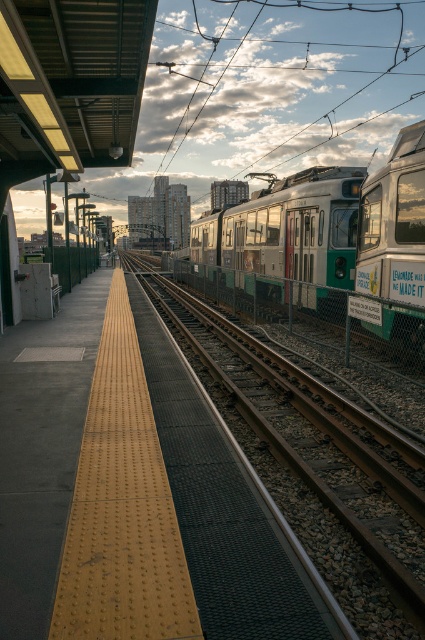
Can you confirm if green metallic train at center is positioned to the left of silver metallic train at center?

Incorrect, green metallic train at center is not on the left side of silver metallic train at center.

Who is higher up, green metallic train at center or silver metallic train at center?

silver metallic train at center is higher up.

Which is behind, point (255, 257) or point (303, 202)?

The point (255, 257) is more distant.

At what (x,y) coordinates should I click in order to perform the action: click on green metallic train at center. Please return your answer as a coordinate pair (x, y). Image resolution: width=425 pixels, height=640 pixels. Looking at the image, I should click on (331, 227).

Does metal/textured track at center appear over green metallic train at center?

Incorrect, metal/textured track at center is not positioned above green metallic train at center.

Who is more distant from viewer, (387,573) or (421,227)?

Point (421,227)

At what (x,y) coordinates should I click in order to perform the action: click on metal/textured track at center. Please return your answer as a coordinate pair (x, y). Looking at the image, I should click on (314, 465).

Does point (274, 442) lie in front of point (342, 244)?

Yes, it is in front of point (342, 244).

Measure the distance from metal/textured track at center to silver metallic train at center.

A distance of 4.01 meters exists between metal/textured track at center and silver metallic train at center.

Where is `metal/textured track at center`? This screenshot has height=640, width=425. metal/textured track at center is located at coordinates (314, 465).